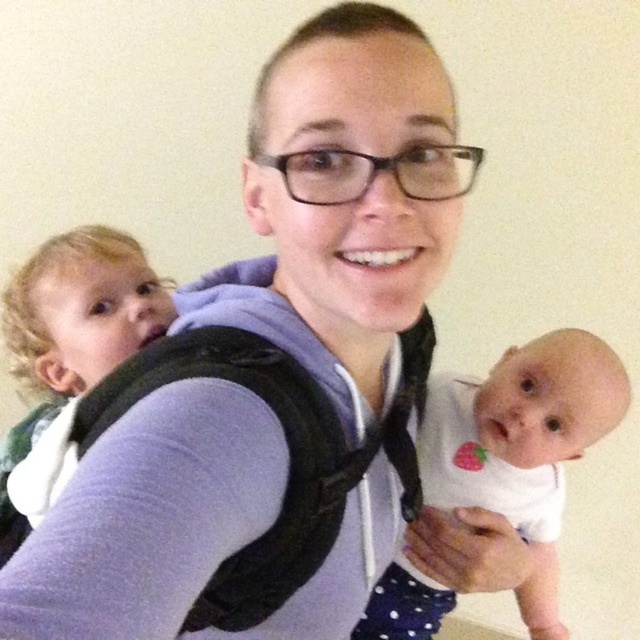
Question: From the image, what is the correct spatial relationship of white soft fabric baby at center in relation to blonde hair baby carrier at upper left?

Choices:
 (A) right
 (B) left

Answer: (A)

Question: Is white soft fabric baby at center in front of blonde hair baby carrier at upper left?

Choices:
 (A) no
 (B) yes

Answer: (B)

Question: Does white soft fabric baby at center appear on the left side of blonde hair baby carrier at upper left?

Choices:
 (A) yes
 (B) no

Answer: (B)

Question: Which point is farther from the camera taking this photo?

Choices:
 (A) (17, 332)
 (B) (552, 531)

Answer: (B)